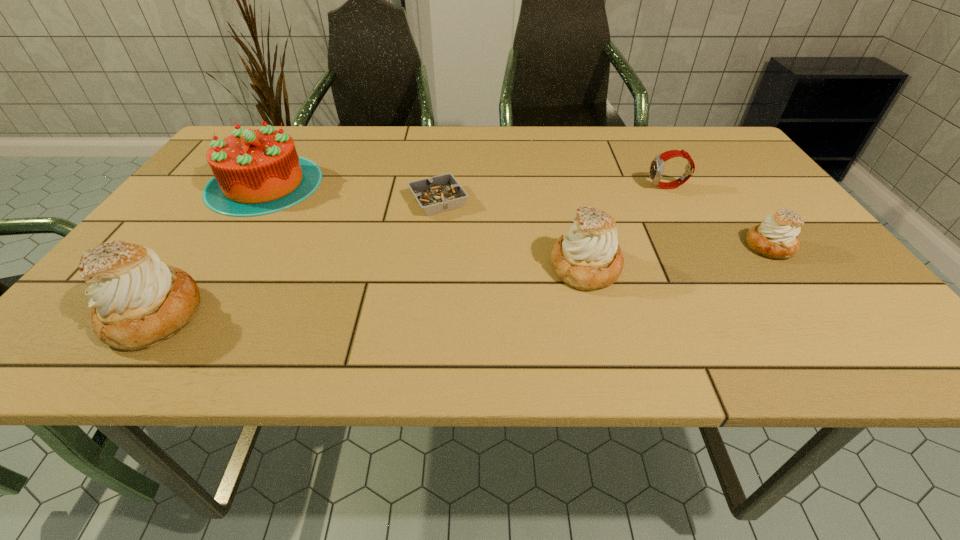
Identify the location of free area in between the ashtray and the leftmost pastry. This screenshot has height=540, width=960. (296, 258).

Identify the location of vacant space that is in between the fourth object from right to left and the fourth object from left to right. (512, 234).

Identify the location of vacant point located between the fourth object from left to right and the cake. The height and width of the screenshot is (540, 960). (424, 225).

Where is `empty space between the shortest object and the watch`? empty space between the shortest object and the watch is located at coordinates (553, 194).

This screenshot has height=540, width=960. I want to click on unoccupied position between the watch and the cake, so click(466, 185).

At what (x,y) coordinates should I click in order to perform the action: click on vacant space in between the watch and the rightmost object. Please return your answer as a coordinate pair (x, y). Looking at the image, I should click on (718, 217).

At what (x,y) coordinates should I click in order to perform the action: click on object that is the fifth closest to the leftmost pastry. Please return your answer as a coordinate pair (x, y). This screenshot has height=540, width=960. Looking at the image, I should click on (x=776, y=238).

Identify which object is the third nearest to the watch. Please provide its 2D coordinates. Your answer should be formatted as a tuple, i.e. [(x, y)], where the tuple contains the x and y coordinates of a point satisfying the conditions above.

[(441, 193)]

Point out which pastry is positioned as the nearest to the rightmost object. Please provide its 2D coordinates. Your answer should be formatted as a tuple, i.e. [(x, y)], where the tuple contains the x and y coordinates of a point satisfying the conditions above.

[(588, 257)]

This screenshot has height=540, width=960. In order to click on pastry that is the closest to the cake in this screenshot , I will do `click(137, 301)`.